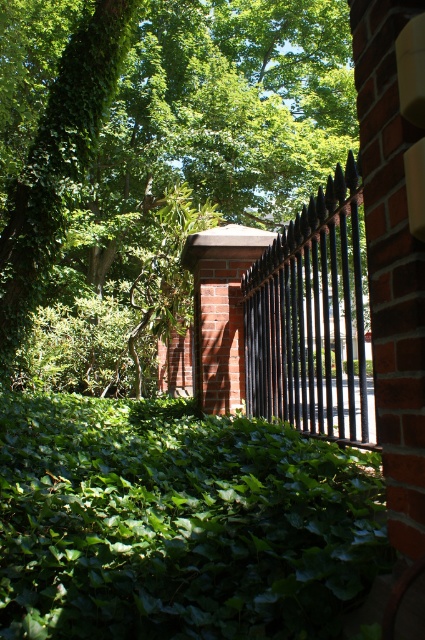
Is point (198, 177) positioned behind point (325, 550)?

Yes, it is behind point (325, 550).

Which is behind, point (320, 61) or point (130, 403)?

Point (320, 61)

Locate an element on the screen. The image size is (425, 640). green leafy tree at upper left is located at coordinates (149, 164).

Where is `green leafy tree at upper left`? The image size is (425, 640). green leafy tree at upper left is located at coordinates (149, 164).

Who is positioned more to the left, green leafy ivy at center or black metal fence at center?

green leafy ivy at center is more to the left.

Is green leafy ivy at center thinner than black metal fence at center?

Incorrect, green leafy ivy at center's width is not less than black metal fence at center's.

This screenshot has height=640, width=425. Describe the element at coordinates (178, 524) in the screenshot. I see `green leafy ivy at center` at that location.

This screenshot has width=425, height=640. In order to click on green leafy ivy at center in this screenshot , I will do `click(178, 524)`.

Does green leafy tree at upper left have a lesser width compared to black metal fence at center?

In fact, green leafy tree at upper left might be wider than black metal fence at center.

Find the location of `green leafy tree at upper left`. green leafy tree at upper left is located at coordinates (149, 164).

Find the location of a particular element. green leafy tree at upper left is located at coordinates (149, 164).

At what (x,y) coordinates should I click in order to perform the action: click on green leafy tree at upper left. Please return your answer as a coordinate pair (x, y). Looking at the image, I should click on (149, 164).